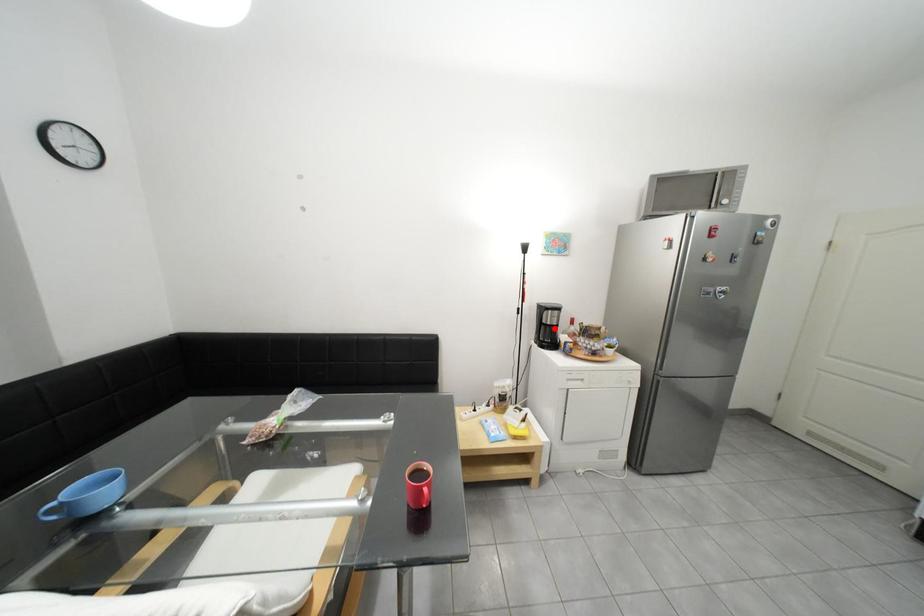
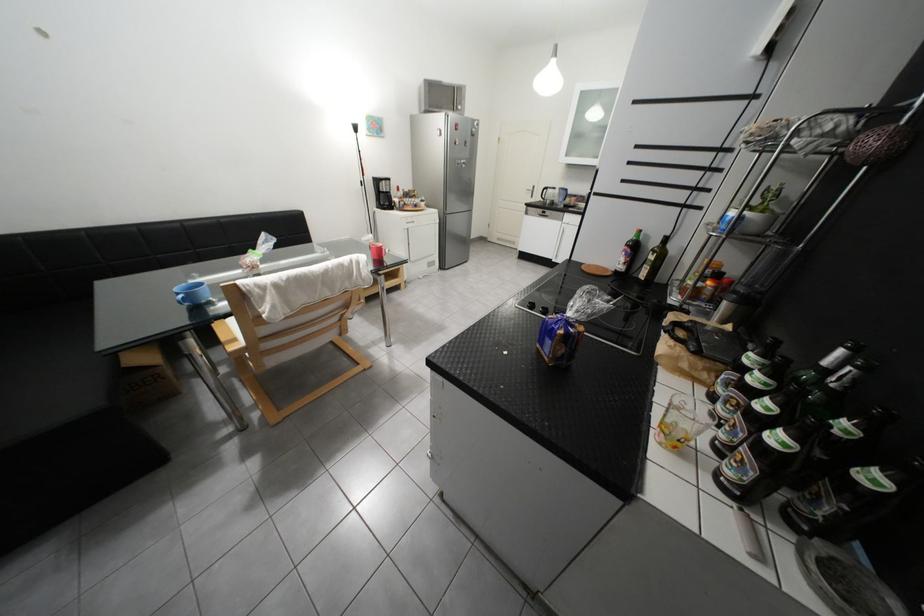
Question: I am providing you with two images of the same scene from different viewpoints. Image1 has a red point marked. In image2, the corresponding 3D location appears at what relative position? Reply with the corresponding letter.

Choices:
 (A) Closer
 (B) Farther

Answer: (A)